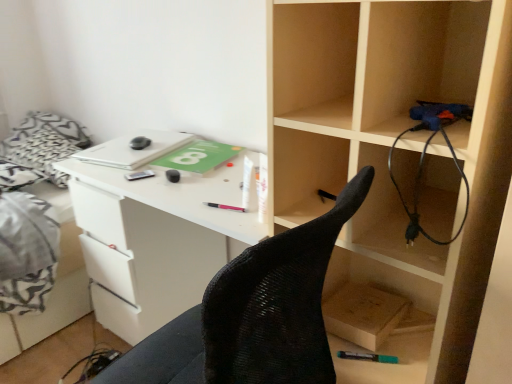
What are the coordinates of `vacant space in front of metallic silver pen at center, the fourth stationery when ordered from right to left` in the screenshot? It's located at (150, 190).